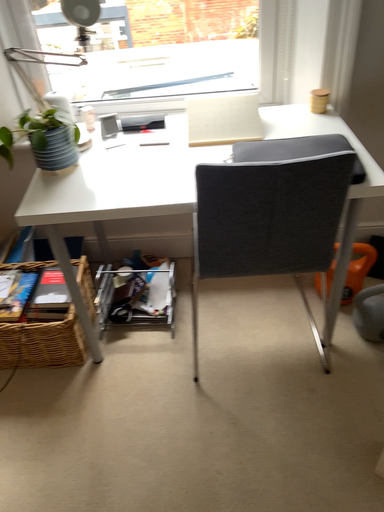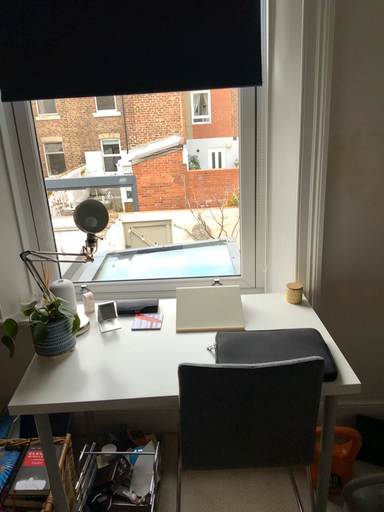
Question: Which way did the camera rotate in the video?

Choices:
 (A) rotated downward
 (B) rotated upward

Answer: (B)